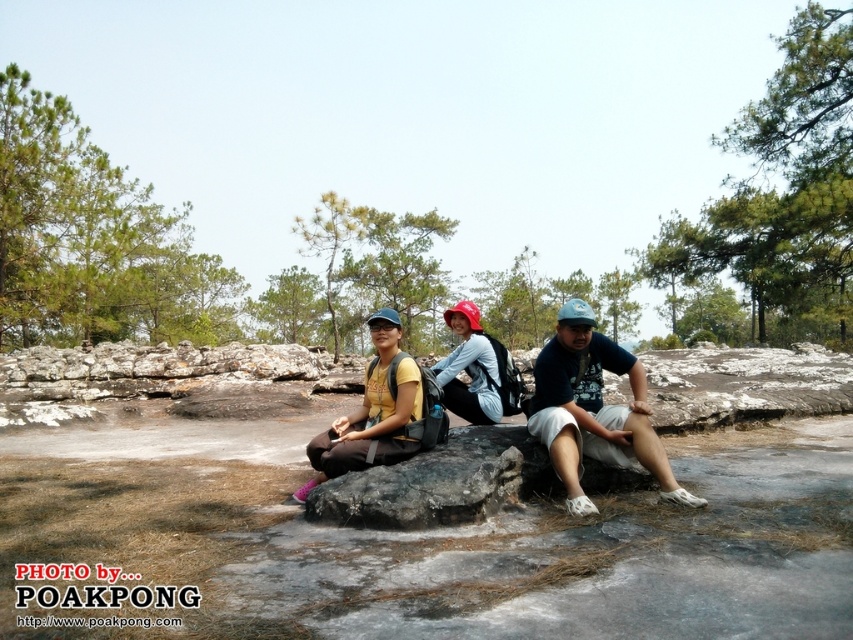
Question: Can you confirm if blue fabric shirt at center is bigger than light blue fabric at center?

Choices:
 (A) no
 (B) yes

Answer: (B)

Question: Which object appears closest to the camera in this image?

Choices:
 (A) gray rough boulder at center
 (B) blue fabric shirt at center
 (C) light blue fabric at center
 (D) matte yellow shirt at center

Answer: (A)

Question: Can you confirm if blue fabric shirt at center is positioned to the left of matte yellow shirt at center?

Choices:
 (A) yes
 (B) no

Answer: (B)

Question: Among these points, which one is farthest from the camera?

Choices:
 (A) (450, 308)
 (B) (338, 428)

Answer: (A)

Question: Does blue fabric shirt at center have a lesser width compared to gray rough boulder at center?

Choices:
 (A) yes
 (B) no

Answer: (A)

Question: Which object is the closest to the gray rough boulder at center?

Choices:
 (A) matte yellow shirt at center
 (B) light blue fabric at center
 (C) blue fabric shirt at center

Answer: (A)